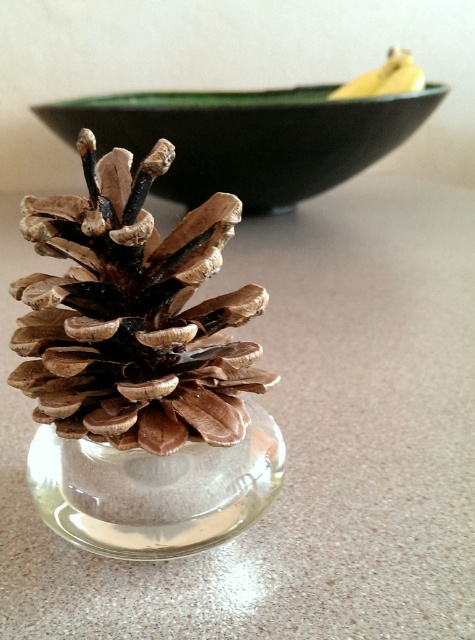
Question: Can you confirm if brown matte pinecone at center is smaller than transparent glass vase at center?

Choices:
 (A) yes
 (B) no

Answer: (B)

Question: Which point is closer to the camera?

Choices:
 (A) brown matte pinecone at center
 (B) transparent glass vase at center
 (C) green matte bowl at upper center

Answer: (A)

Question: Which point appears closest to the camera in this image?

Choices:
 (A) (227, 531)
 (B) (402, 51)
 (C) (379, 132)

Answer: (A)

Question: Is green matte bowl at upper center to the left of transparent glass vase at center from the viewer's perspective?

Choices:
 (A) yes
 (B) no

Answer: (B)

Question: Estimate the real-world distances between objects in this image. Which object is closer to the transparent glass vase at center?

Choices:
 (A) brown matte pinecone at center
 (B) green matte bowl at upper center
 (C) translucent glass table at center

Answer: (A)

Question: Does translucent glass table at center appear under green matte bowl at upper center?

Choices:
 (A) no
 (B) yes

Answer: (B)